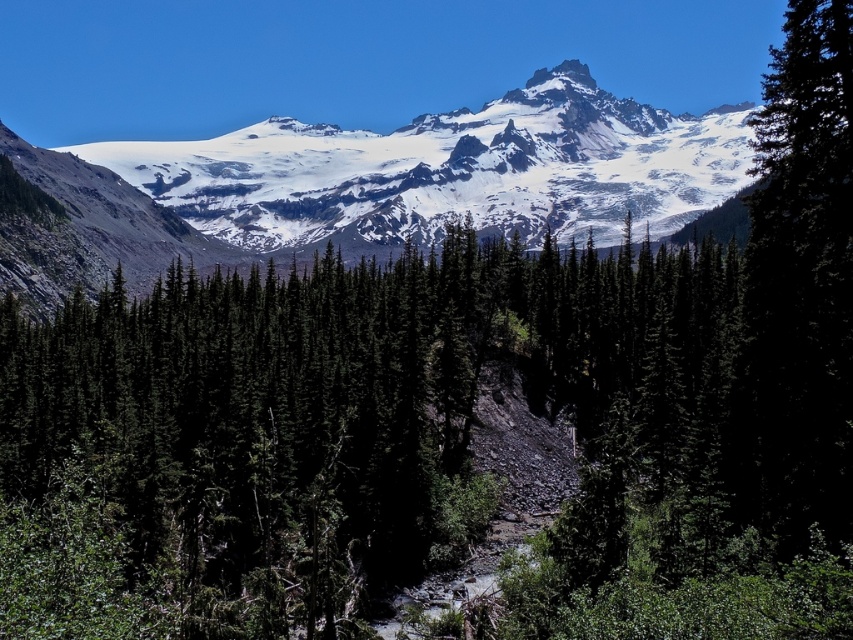
Question: Can you confirm if green matte tree at center is wider than white rocky peak at upper center?

Choices:
 (A) no
 (B) yes

Answer: (B)

Question: Can you confirm if green matte tree at center is positioned above green matte tree at right?

Choices:
 (A) no
 (B) yes

Answer: (A)

Question: Which object is farther from the camera taking this photo?

Choices:
 (A) snowy granite mountain range at upper center
 (B) white rocky peak at upper center
 (C) green matte tree at right
 (D) green matte tree at center

Answer: (B)

Question: Estimate the real-world distances between objects in this image. Which object is closer to the white rocky peak at upper center?

Choices:
 (A) snowy granite mountain range at upper center
 (B) green matte tree at right

Answer: (A)

Question: Can you confirm if green matte tree at center is wider than snowy granite mountain range at upper center?

Choices:
 (A) yes
 (B) no

Answer: (B)

Question: Which of the following is the closest to the observer?

Choices:
 (A) (517, 163)
 (B) (840, 211)

Answer: (B)